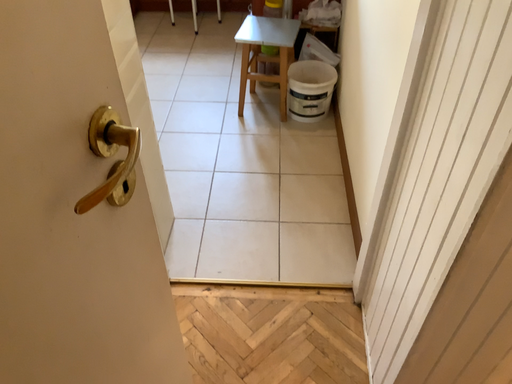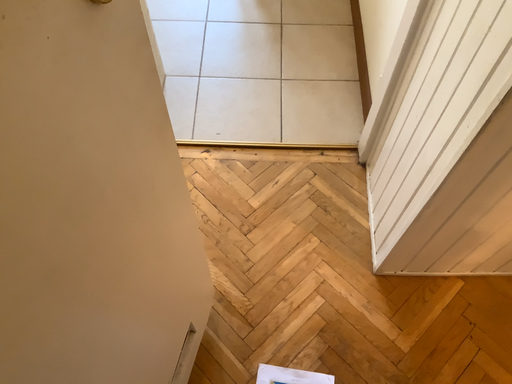
Question: How did the camera likely rotate when shooting the video?

Choices:
 (A) rotated downward
 (B) rotated upward

Answer: (A)